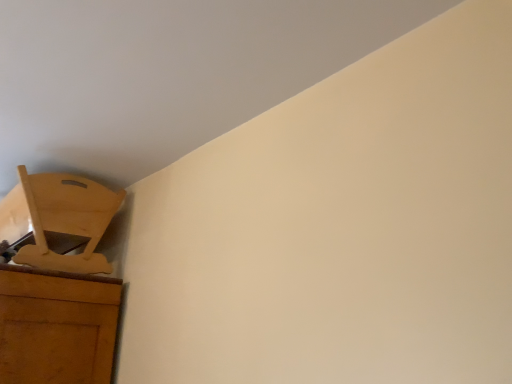
The width and height of the screenshot is (512, 384). Identify the location of light wood high chair at left. (58, 221).

What do you see at coordinates (58, 221) in the screenshot? The image size is (512, 384). I see `light wood high chair at left` at bounding box center [58, 221].

At what (x,y) coordinates should I click in order to perform the action: click on light wood high chair at left. Please return your answer as a coordinate pair (x, y). Looking at the image, I should click on (58, 221).